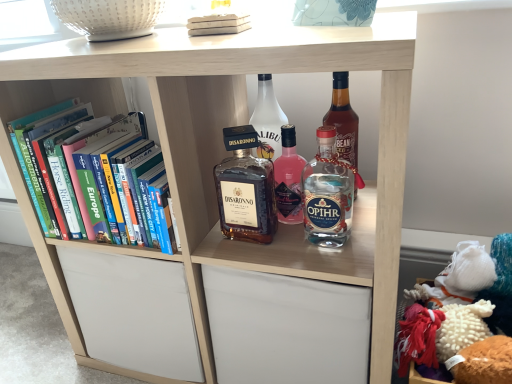
This screenshot has height=384, width=512. In order to click on free point to the right of white matte book at upper center, the 2th book in the bottom-to-top sequence in this screenshot , I will do `click(301, 26)`.